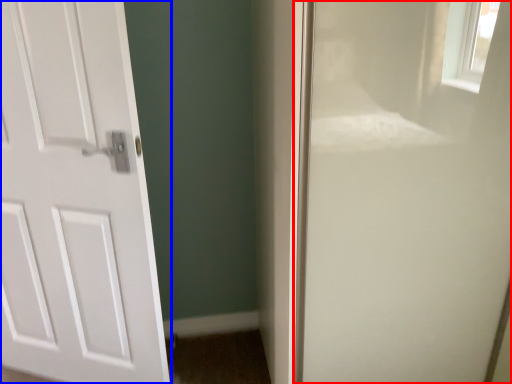
Question: Which point is further to the camera, screen door (highlighted by a red box) or door (highlighted by a blue box)?

Choices:
 (A) screen door
 (B) door

Answer: (B)